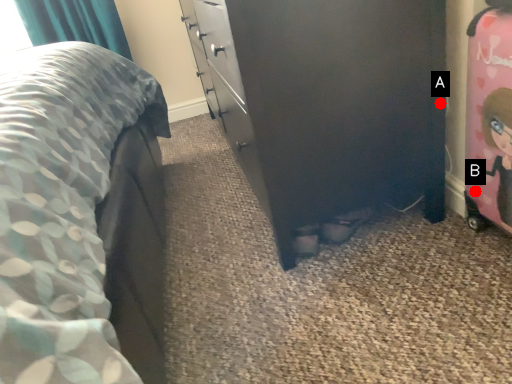
Question: Two points are circled on the image, labeled by A and B beside each circle. Which point appears closest to the camera in this image?

Choices:
 (A) A is closer
 (B) B is closer

Answer: (B)